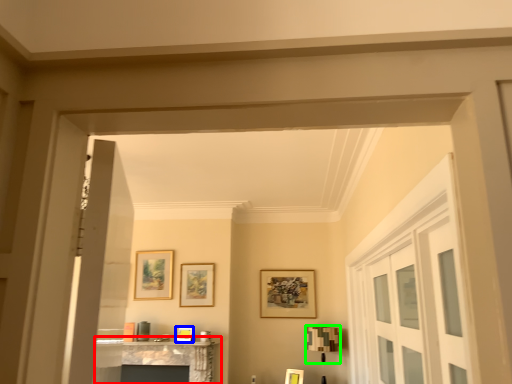
Question: Estimate the real-world distances between objects in this image. Which object is farther from table (highlighted by a red box), picture frame (highlighted by a blue box) or lamp (highlighted by a green box)?

Choices:
 (A) picture frame
 (B) lamp

Answer: (B)